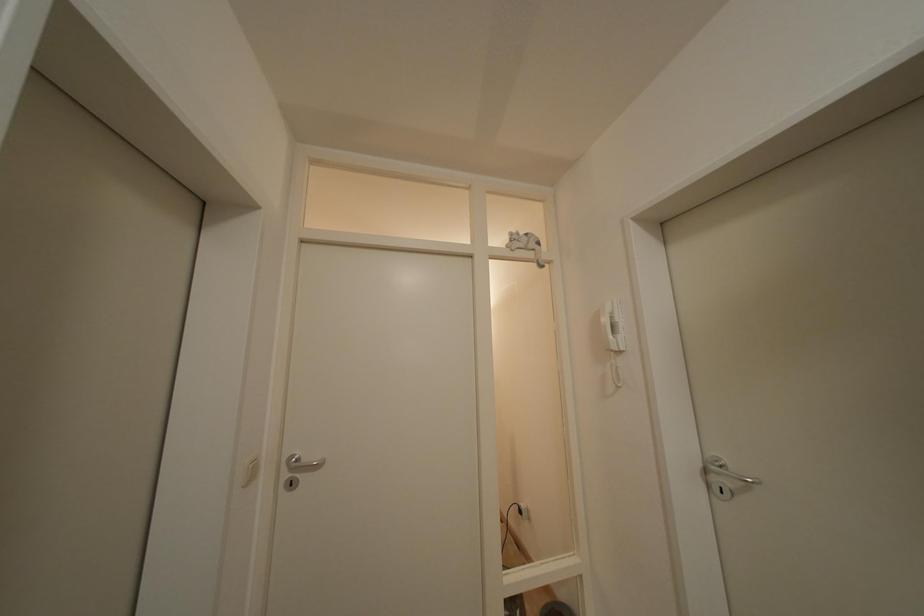
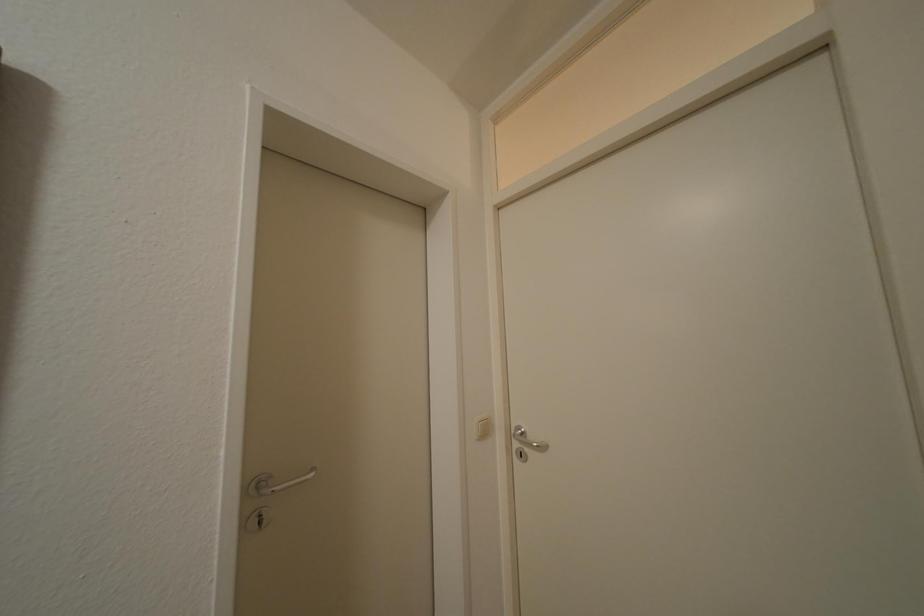
Question: The camera is either moving clockwise (left) or counter-clockwise (right) around the object. The first image is from the beginning of the video and the second image is from the end. Is the camera moving left or right when shooting the video?

Choices:
 (A) Left
 (B) Right

Answer: (B)